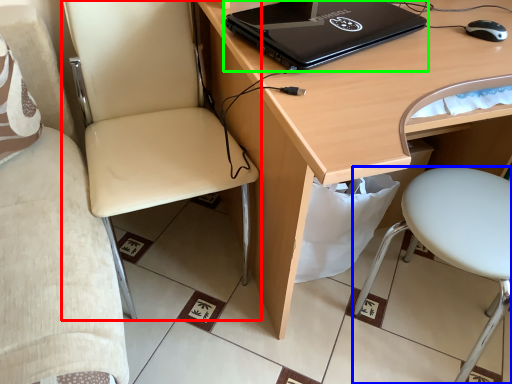
Question: Which object is the closest to the chair (highlighted by a red box)? Choose among these: chair (highlighted by a blue box) or laptop (highlighted by a green box).

Choices:
 (A) chair
 (B) laptop

Answer: (B)